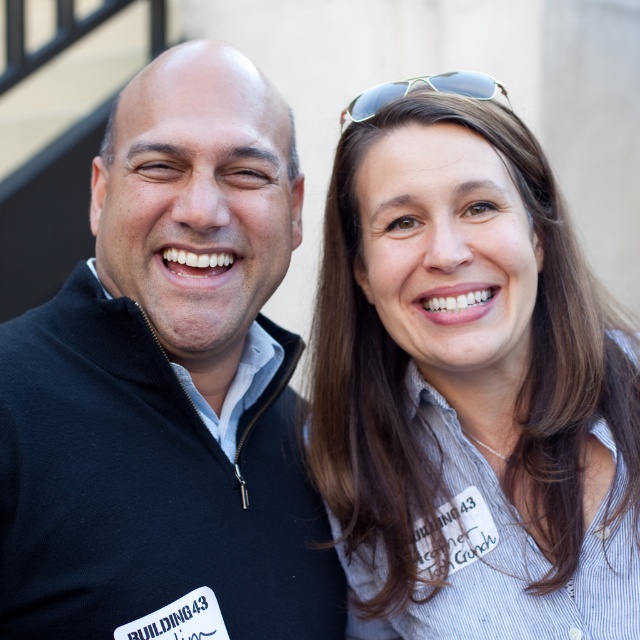
Question: Which of the following is the farthest from the observer?

Choices:
 (A) (392, 84)
 (B) (285, 625)
 (C) (566, 609)

Answer: (B)

Question: Considering the relative positions of striped shirt at center and sunglasses at upper center in the image provided, where is striped shirt at center located with respect to sunglasses at upper center?

Choices:
 (A) above
 (B) below

Answer: (B)

Question: Is striped shirt at center above black fleece at left?

Choices:
 (A) no
 (B) yes

Answer: (A)

Question: Is striped shirt at center above black fleece at left?

Choices:
 (A) yes
 (B) no

Answer: (B)

Question: Which of the following is the closest to the observer?

Choices:
 (A) sunglasses at upper center
 (B) striped shirt at center

Answer: (B)

Question: Among these objects, which one is farthest from the camera?

Choices:
 (A) striped shirt at center
 (B) sunglasses at upper center
 (C) black fleece at left

Answer: (B)